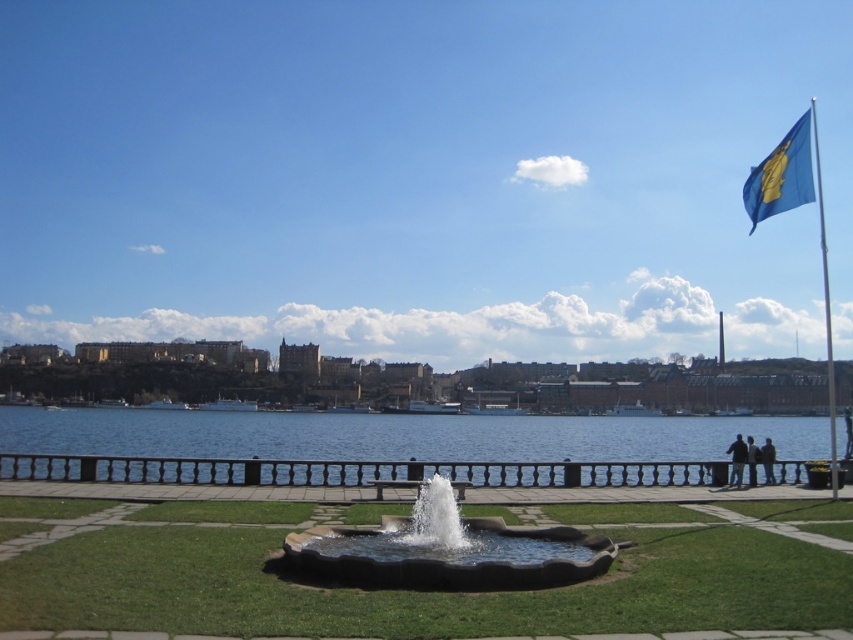
Who is more distant from viewer, (28, 509) or (772, 212)?

Positioned behind is point (772, 212).

Where is `green grass at center`? The height and width of the screenshot is (640, 853). green grass at center is located at coordinates (396, 589).

Who is lower down, blue fabric flag at upper right or white metallic flag pole at upper right?

white metallic flag pole at upper right is lower down.

Image resolution: width=853 pixels, height=640 pixels. What do you see at coordinates (782, 173) in the screenshot? I see `blue fabric flag at upper right` at bounding box center [782, 173].

Which is in front, point (753, 198) or point (825, 317)?

Positioned in front is point (753, 198).

The image size is (853, 640). Find the location of `blue fabric flag at upper right`. blue fabric flag at upper right is located at coordinates (782, 173).

What do you see at coordinates (396, 589) in the screenshot? I see `green grass at center` at bounding box center [396, 589].

The image size is (853, 640). Find the location of `green grass at center`. green grass at center is located at coordinates (396, 589).